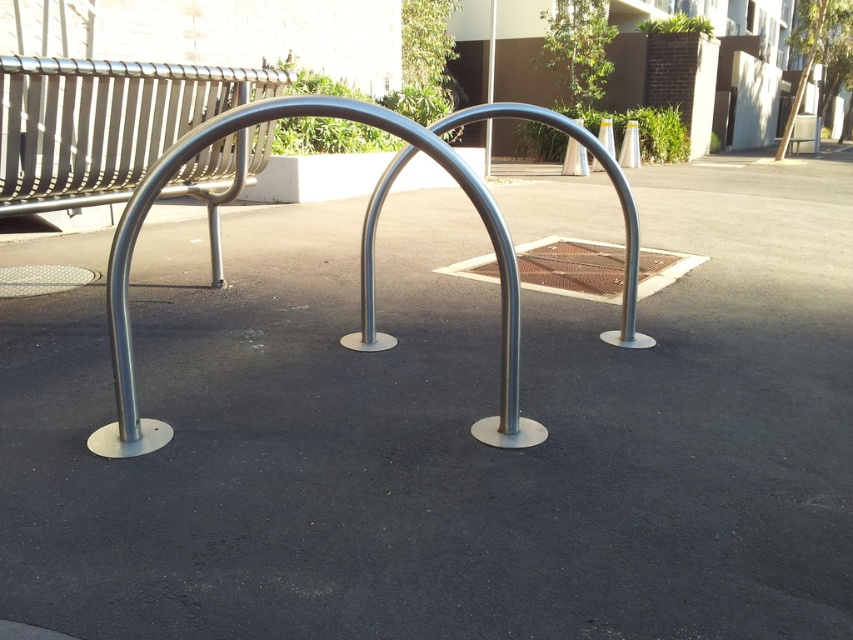
Question: Which point is closer to the camera?

Choices:
 (A) polished metal bike rack at center
 (B) silver metallic pole at center

Answer: (A)

Question: Which point appears closest to the camera in this image?

Choices:
 (A) (521, 440)
 (B) (492, 58)

Answer: (A)

Question: Considering the relative positions of polished metal bike rack at center and silver metallic pole at center in the image provided, where is polished metal bike rack at center located with respect to silver metallic pole at center?

Choices:
 (A) above
 (B) below

Answer: (B)

Question: Does satin silver bench at upper left have a greater width compared to silver metallic pole at center?

Choices:
 (A) no
 (B) yes

Answer: (B)

Question: Can you confirm if satin silver bench at upper left is positioned above silver metallic pole at center?

Choices:
 (A) yes
 (B) no

Answer: (B)

Question: Which point is farther to the camera?

Choices:
 (A) polished metal bike rack at center
 (B) silver metallic pole at center

Answer: (B)